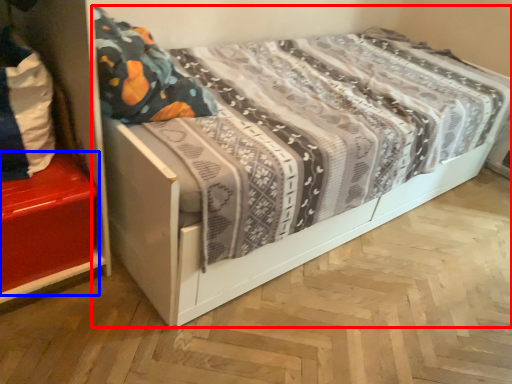
Question: Among these objects, which one is nearest to the camera, bed (highlighted by a red box) or shelf (highlighted by a blue box)?

Choices:
 (A) bed
 (B) shelf

Answer: (A)